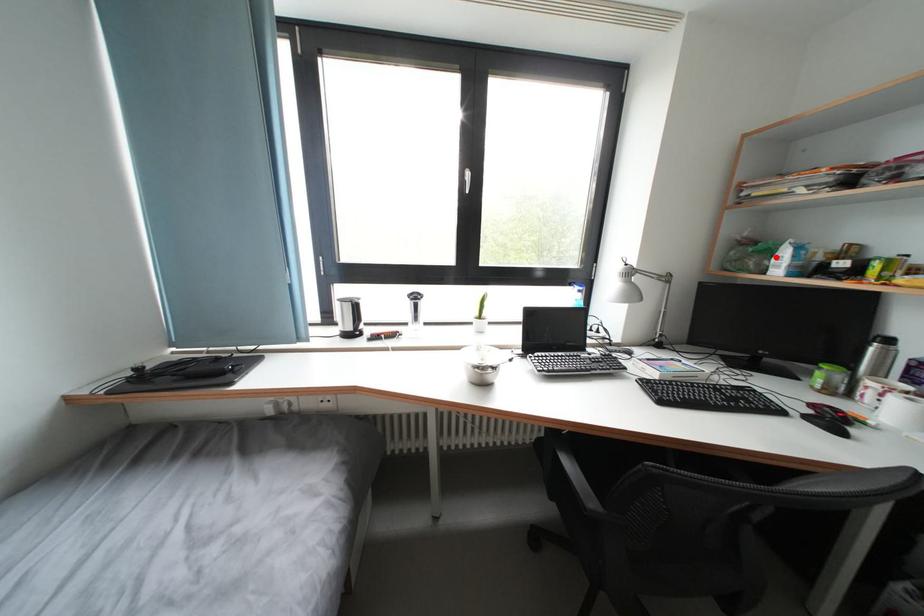
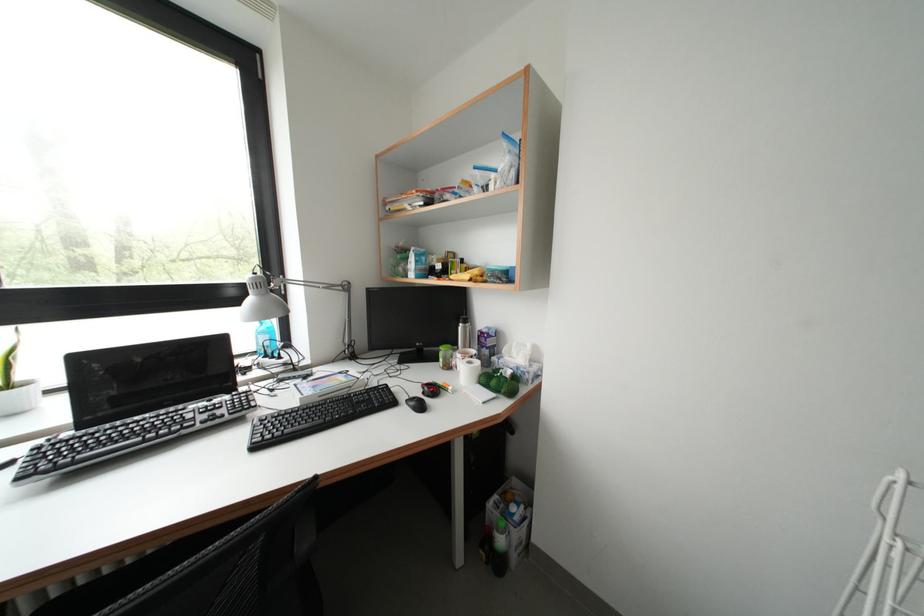
Locate, in the second image, the point that corresponds to the highlighted location in the first image.

(415, 264)